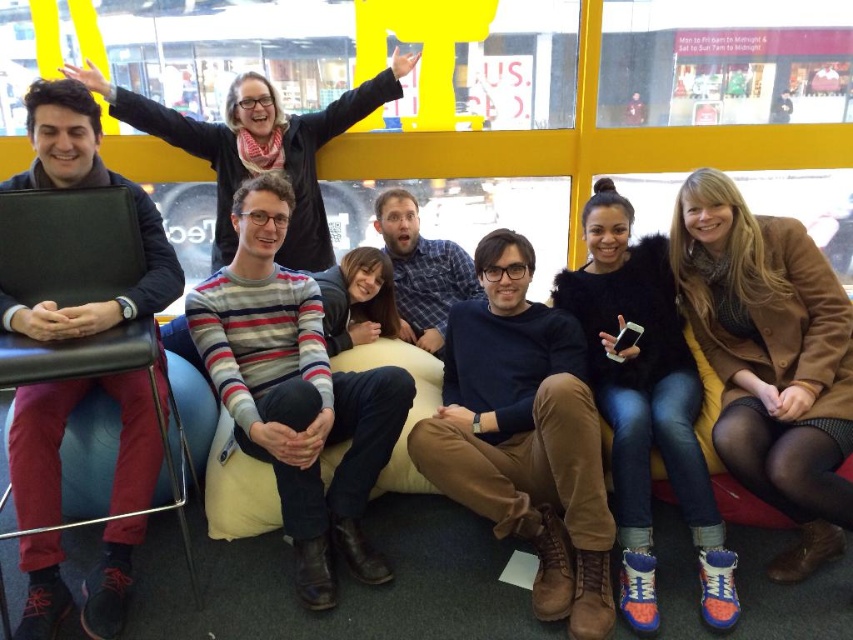
Identify the location of brown leather jacket at upper right. This screenshot has height=640, width=853. (770, 358).

Does brown leather jacket at upper right have a larger size compared to striped sweater at center?

No, brown leather jacket at upper right is not bigger than striped sweater at center.

Is point (782, 284) behind point (207, 362)?

That is True.

Identify the location of brown leather jacket at upper right. The image size is (853, 640). (770, 358).

Is point (621, 323) closer to camera compared to point (308, 124)?

Yes, it is.

Who is positioned more to the left, denim jeans at lower right or matte black laptop at left?

Positioned to the left is matte black laptop at left.

Does point (640, 531) come in front of point (331, 125)?

Yes, point (640, 531) is in front of point (331, 125).

The width and height of the screenshot is (853, 640). Identify the location of denim jeans at lower right. (645, 404).

Who is taller, brown leather jacket at upper right or dark blue sweater at center?

brown leather jacket at upper right is taller.

Is point (709, 301) farther from camera compared to point (602, 564)?

Yes, point (709, 301) is behind point (602, 564).

Between point (846, 512) and point (503, 412), which one is positioned behind?

The point (503, 412) is more distant.

Identify the location of brown leather jacket at upper right. The width and height of the screenshot is (853, 640). (770, 358).